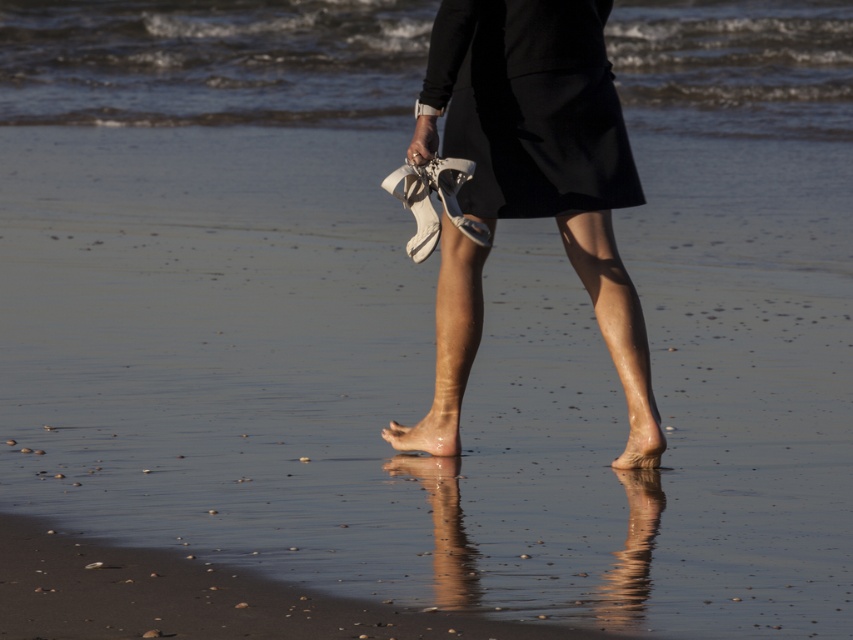
Question: Which point is farther to the camera?

Choices:
 (A) (624, 189)
 (B) (612, 196)
 (C) (758, 100)
 (D) (434, 422)

Answer: (C)

Question: Can you confirm if white leather sandals at center is bigger than dry skin foot at lower center?

Choices:
 (A) yes
 (B) no

Answer: (A)

Question: Is clear water at center to the right of smooth skin foot at center from the viewer's perspective?

Choices:
 (A) yes
 (B) no

Answer: (B)

Question: Considering the real-world distances, which object is closest to the dry skin foot at lower center?

Choices:
 (A) clear water at center
 (B) white leather sandals at center
 (C) black matte dress at center
 (D) smooth skin foot at center

Answer: (D)

Question: Can you confirm if clear water at center is positioned above smooth skin foot at center?

Choices:
 (A) yes
 (B) no

Answer: (A)

Question: Which object is farther from the camera taking this photo?

Choices:
 (A) clear water at center
 (B) smooth skin foot at center

Answer: (A)